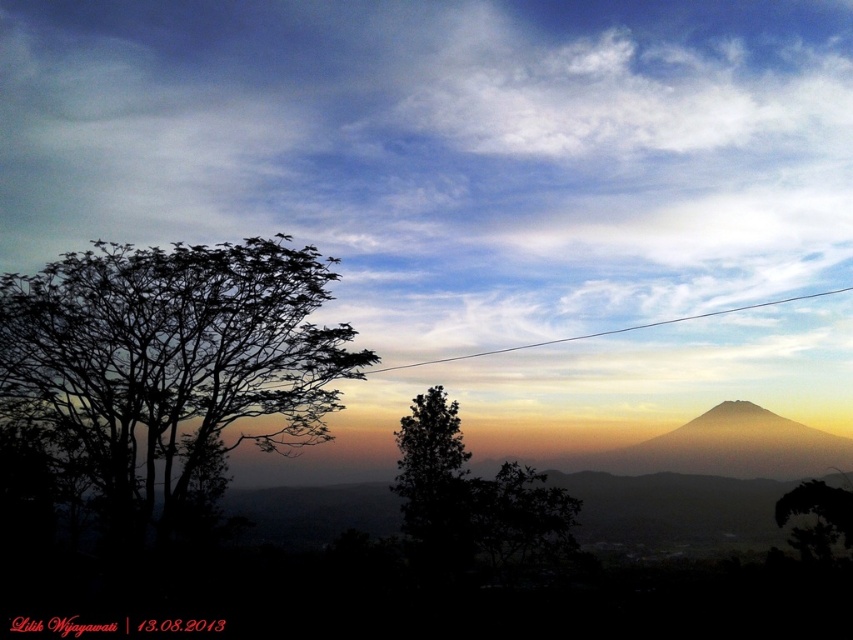
You are an electrician inspecting a landscape scene. You notice a green leafy tree at center and a white wire at upper center. Which object occupies more horizontal space in the image?

The white wire at upper center occupies more horizontal space than the green leafy tree at center because the green leafy tree at center has a lesser width compared to white wire at upper center.

You are standing in the landscape scene and want to reach the point at the top of the sky. Which point should you walk towards, point at point at [519,522] or point at [791,298]?

You should walk towards point at [791,298] because it is higher up in the sky compared to point at [519,522].

You are an electrician inspecting the scene. You notice the green leafy tree at center and the white wire at upper center. Which object is closer to the horizon?

The white wire at upper center is closer to the horizon than the green leafy tree at center because the green leafy tree at center is positioned under it, meaning the wire is higher in the frame and thus nearer to the horizon line.